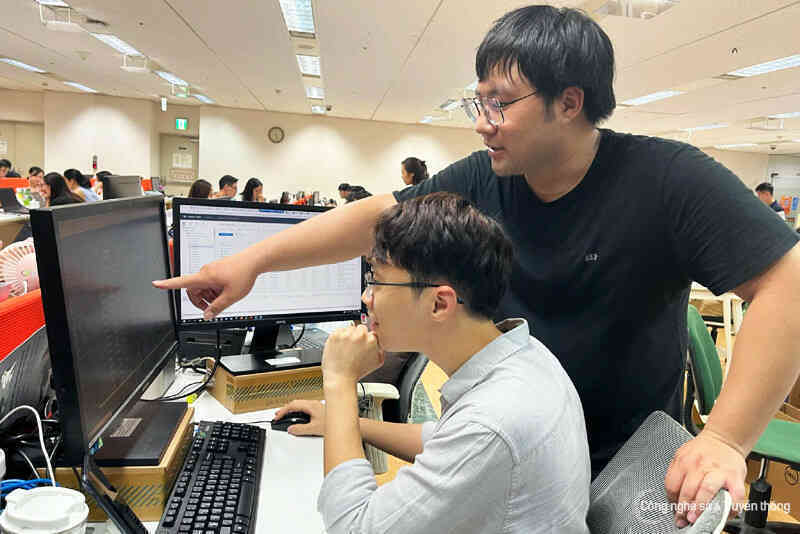
At what (x,y) coordinates should I click in order to perform the action: click on green chair. Please return your answer as a coordinate pair (x, y). The height and width of the screenshot is (534, 800). Looking at the image, I should click on (786, 433).